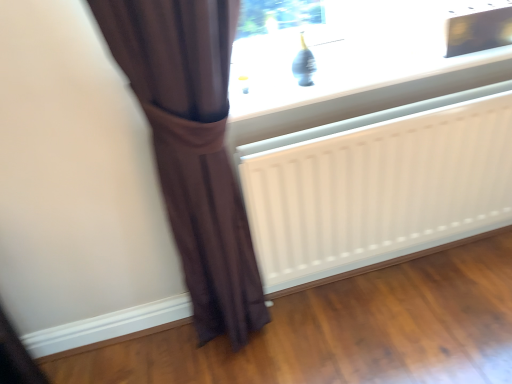
Question: Is matte glass window at upper center located within brown fabric curtain at left?

Choices:
 (A) no
 (B) yes

Answer: (A)

Question: Does brown fabric curtain at left touch matte glass window at upper center?

Choices:
 (A) yes
 (B) no

Answer: (B)

Question: Could you tell me if brown fabric curtain at left is turned towards matte glass window at upper center?

Choices:
 (A) yes
 (B) no

Answer: (B)

Question: Does brown fabric curtain at left come in front of matte glass window at upper center?

Choices:
 (A) yes
 (B) no

Answer: (A)

Question: From the image's perspective, is brown fabric curtain at left on matte glass window at upper center?

Choices:
 (A) yes
 (B) no

Answer: (B)

Question: Is brown fabric curtain at left further to camera compared to matte glass window at upper center?

Choices:
 (A) yes
 (B) no

Answer: (B)

Question: Can you confirm if matte glass window at upper center is shorter than white matte radiator at lower center?

Choices:
 (A) yes
 (B) no

Answer: (A)

Question: From the image's perspective, would you say matte glass window at upper center is shown under white matte radiator at lower center?

Choices:
 (A) no
 (B) yes

Answer: (A)

Question: Could you tell me if matte glass window at upper center is turned towards white matte radiator at lower center?

Choices:
 (A) no
 (B) yes

Answer: (A)

Question: From a real-world perspective, is matte glass window at upper center over white matte radiator at lower center?

Choices:
 (A) yes
 (B) no

Answer: (A)

Question: Can you confirm if matte glass window at upper center is taller than white matte radiator at lower center?

Choices:
 (A) no
 (B) yes

Answer: (A)

Question: Is matte glass window at upper center bigger than white matte radiator at lower center?

Choices:
 (A) yes
 (B) no

Answer: (B)

Question: Is matte glass window at upper center not close to brown fabric curtain at left?

Choices:
 (A) no
 (B) yes

Answer: (A)